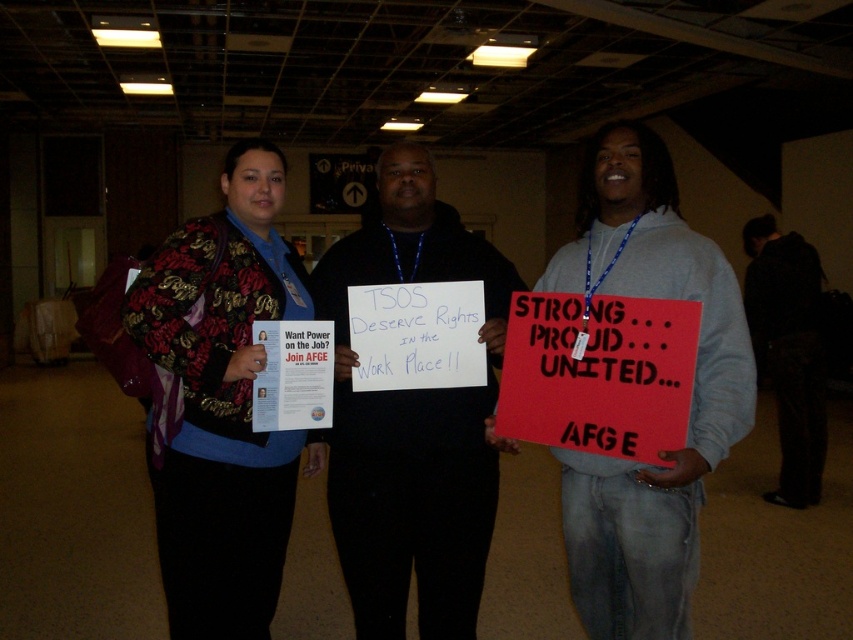
Question: Which point is closer to the camera taking this photo?

Choices:
 (A) (405, 205)
 (B) (814, 300)
 (C) (612, 588)

Answer: (C)

Question: In this image, where is floral-patterned jacket at center located relative to matte black shirt at center?

Choices:
 (A) right
 (B) left

Answer: (B)

Question: Can you confirm if matte black shirt at center is thinner than dark fabric pants at right?

Choices:
 (A) no
 (B) yes

Answer: (A)

Question: Which point appears farthest from the camera in this image?

Choices:
 (A) click(592, 195)
 (B) click(805, 333)

Answer: (B)

Question: Among these objects, which one is nearest to the camera?

Choices:
 (A) black hoodie at center
 (B) dark fabric pants at right
 (C) floral-patterned jacket at center

Answer: (C)

Question: Can you confirm if floral-patterned jacket at center is smaller than dark fabric pants at right?

Choices:
 (A) yes
 (B) no

Answer: (A)